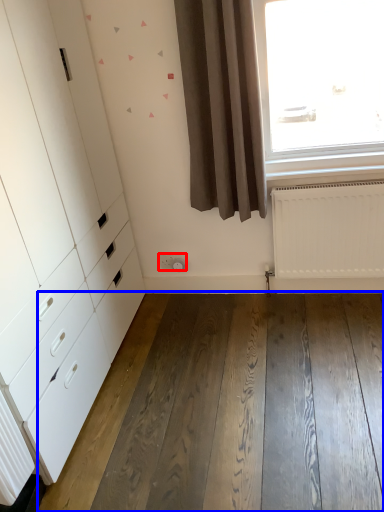
Question: Among these objects, which one is farthest to the camera, electric outlet (highlighted by a red box) or hardwood (highlighted by a blue box)?

Choices:
 (A) electric outlet
 (B) hardwood

Answer: (A)